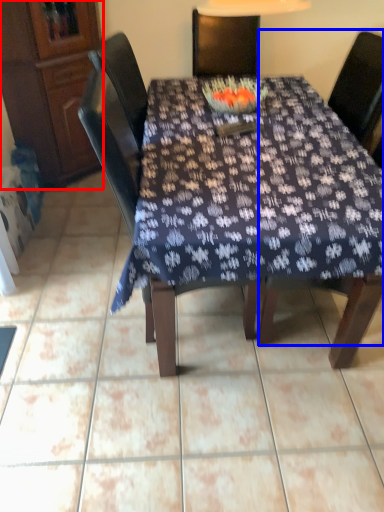
Question: Which object is closer to the camera taking this photo, cabinetry (highlighted by a red box) or chair (highlighted by a blue box)?

Choices:
 (A) cabinetry
 (B) chair

Answer: (B)